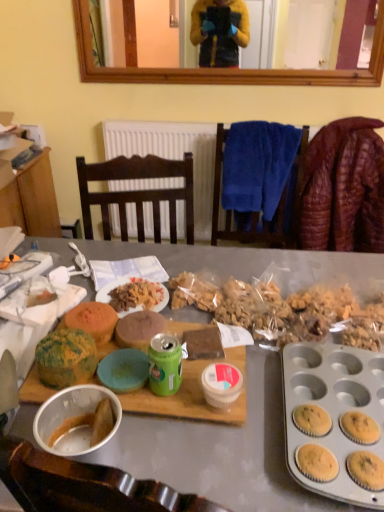
Question: Can you confirm if green matte can at center is bigger than leather jacket at right?

Choices:
 (A) yes
 (B) no

Answer: (B)

Question: Can we say green matte can at center lies outside leather jacket at right?

Choices:
 (A) no
 (B) yes

Answer: (B)

Question: Considering the relative positions of green matte can at center and leather jacket at right in the image provided, is green matte can at center to the left of leather jacket at right from the viewer's perspective?

Choices:
 (A) no
 (B) yes

Answer: (B)

Question: Can you confirm if green matte can at center is shorter than leather jacket at right?

Choices:
 (A) no
 (B) yes

Answer: (B)

Question: From the image's perspective, does green matte can at center appear higher than leather jacket at right?

Choices:
 (A) no
 (B) yes

Answer: (A)

Question: Would you say leather jacket at right is part of green matte can at center's contents?

Choices:
 (A) yes
 (B) no

Answer: (B)

Question: Is speckled yellow muffin at center-left, which is the 1th snack from front to back, facing towards blue soft towel at upper center?

Choices:
 (A) yes
 (B) no

Answer: (B)

Question: Could blue soft towel at upper center be considered to be inside speckled yellow muffin at center-left, which is the 1th snack from front to back?

Choices:
 (A) no
 (B) yes

Answer: (A)

Question: From a real-world perspective, is speckled yellow muffin at center-left, which appears as the second snack when viewed from the back, physically above blue soft towel at upper center?

Choices:
 (A) no
 (B) yes

Answer: (A)

Question: Are speckled yellow muffin at center-left, which appears as the second snack when viewed from the back, and blue soft towel at upper center located far from each other?

Choices:
 (A) yes
 (B) no

Answer: (A)

Question: From the image's perspective, does speckled yellow muffin at center-left, which is the 1th snack from front to back, appear lower than blue soft towel at upper center?

Choices:
 (A) yes
 (B) no

Answer: (A)

Question: Is the depth of speckled yellow muffin at center-left, which appears as the second snack when viewed from the back, less than that of blue soft towel at upper center?

Choices:
 (A) no
 (B) yes

Answer: (B)

Question: From a real-world perspective, is matte gray desk at center beneath leather jacket at right?

Choices:
 (A) yes
 (B) no

Answer: (A)